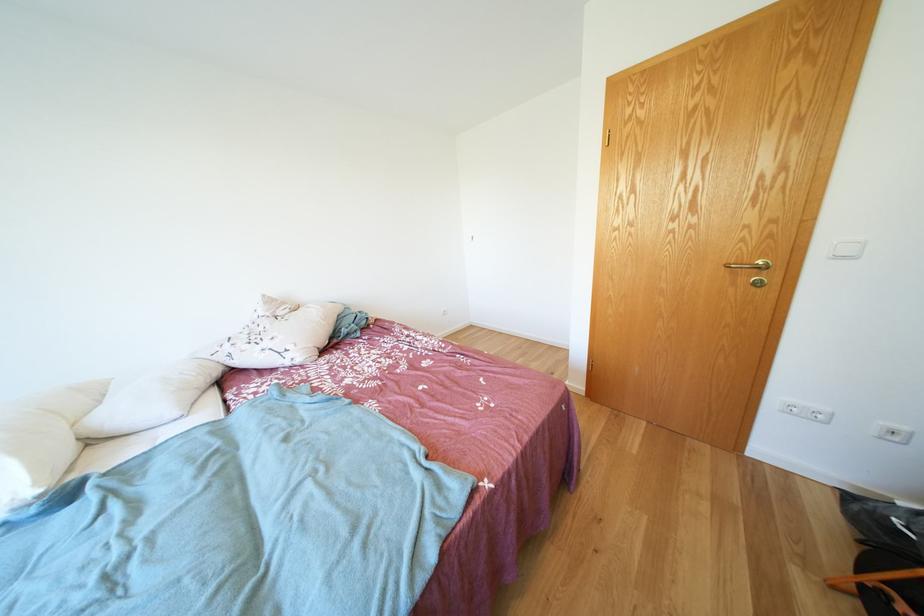
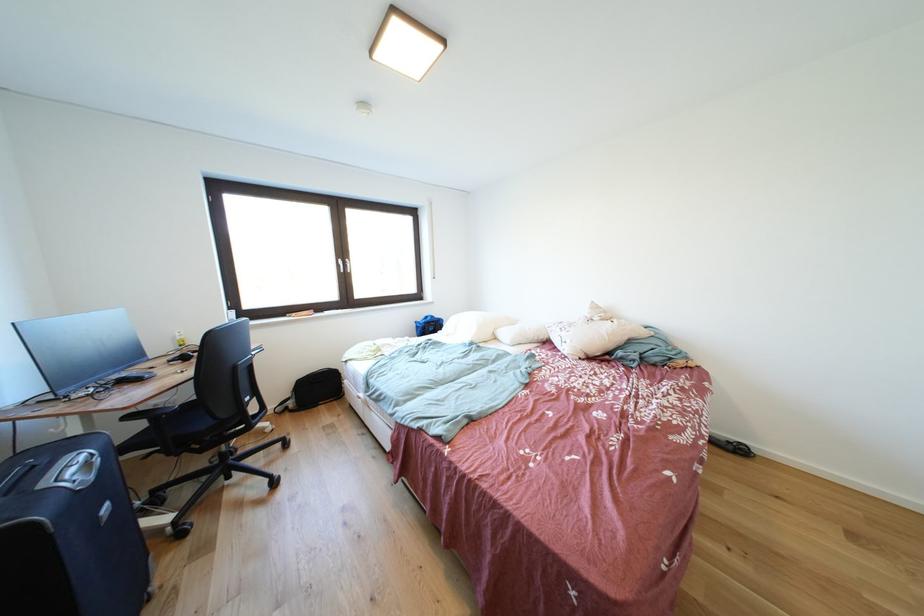
The point at (274, 349) is marked in the first image. Where is the corresponding point in the second image?

(572, 338)